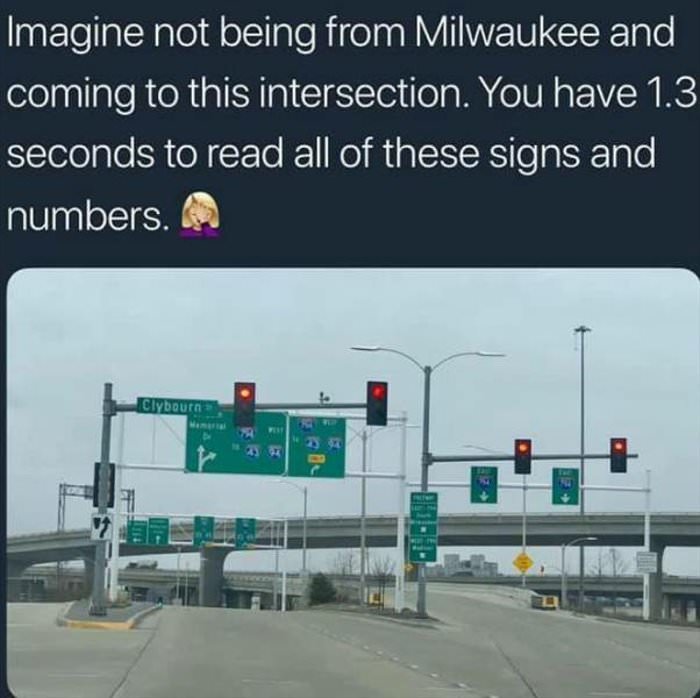
This screenshot has width=700, height=698. Identify the location of columns. (214, 588), (659, 597), (88, 565), (19, 562).